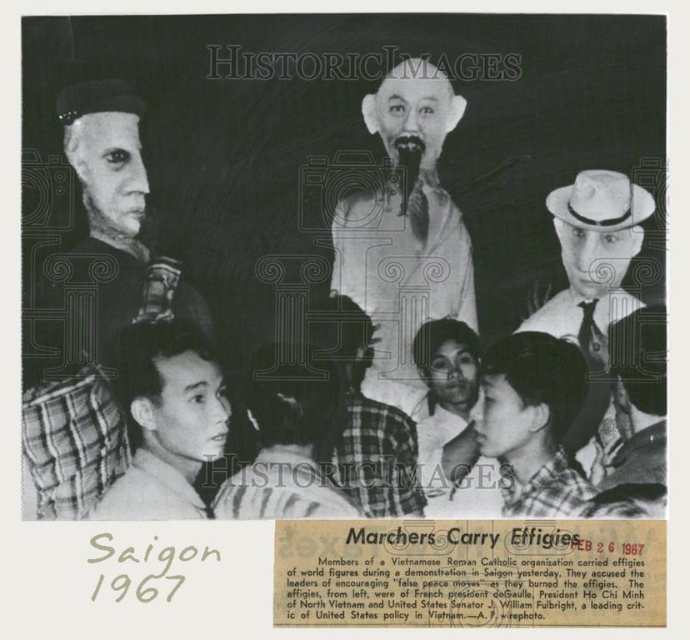
Question: Which is farther from the white matte figure at center?

Choices:
 (A) smooth leather hat at upper right
 (B) white felt hat at upper right
 (C) plaid shirt at center

Answer: (A)

Question: Is white matte figure at center further to the viewer compared to plaid shirt at center?

Choices:
 (A) yes
 (B) no

Answer: (A)

Question: Which object is closer to the camera taking this photo?

Choices:
 (A) smooth white statue at upper center
 (B) plaid shirt at center
 (C) smooth painted face at upper left
 (D) plaid shirt at lower left

Answer: (D)

Question: Which of the following is the closest to the observer?

Choices:
 (A) 586,227
 (B) 177,269
 (C) 662,346
 (D) 126,497

Answer: (D)

Question: Can you confirm if white matte figure at center is thinner than plaid shirt at lower left?

Choices:
 (A) yes
 (B) no

Answer: (B)

Question: Observing the image, what is the correct spatial positioning of smooth painted face at upper left in reference to plaid shirt at center?

Choices:
 (A) above
 (B) below

Answer: (A)